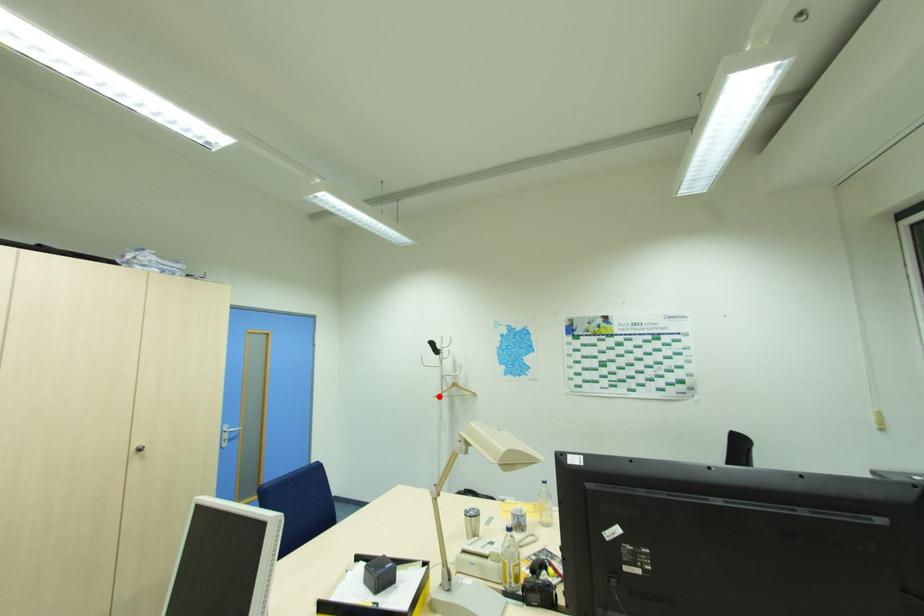
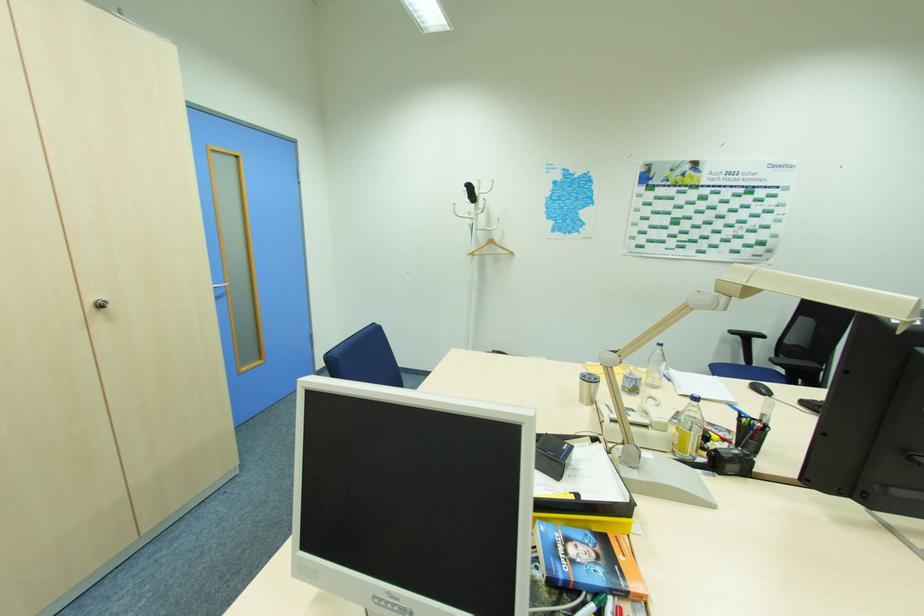
In the second image, find the point that corresponds to the highlighted location in the first image.

(472, 254)